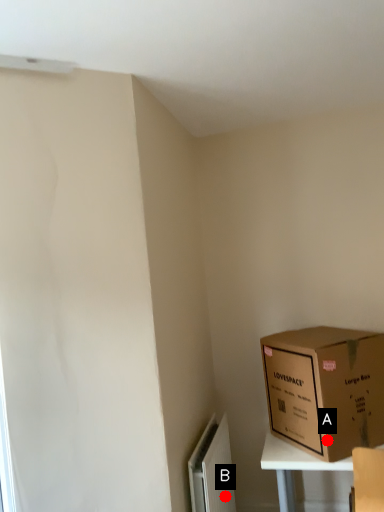
Question: Two points are circled on the image, labeled by A and B beside each circle. Among these points, which one is farthest from the camera?

Choices:
 (A) A is further
 (B) B is further

Answer: (B)